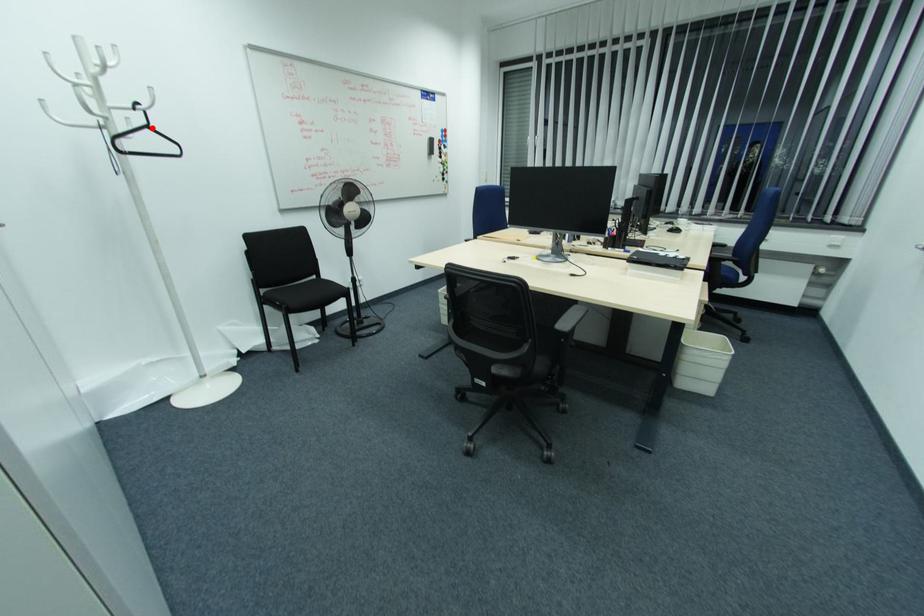
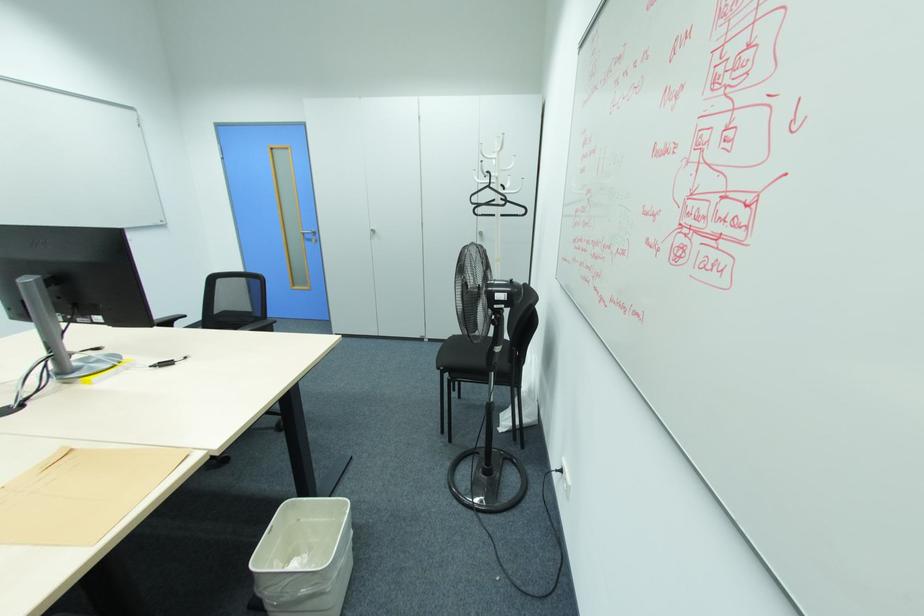
In the second image, find the point that corresponds to the highlighted location in the first image.

(492, 185)